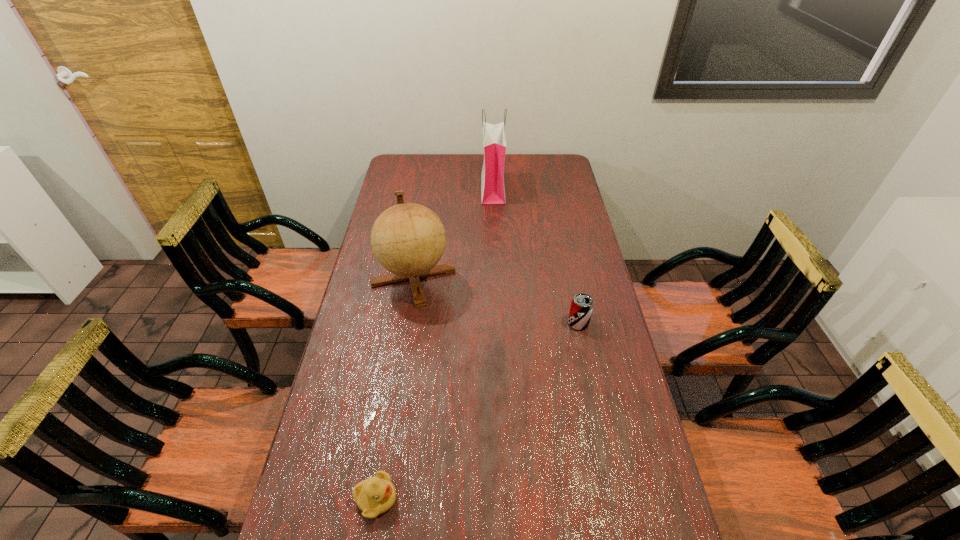
Image resolution: width=960 pixels, height=540 pixels. Find the location of `shopping bag`. shopping bag is located at coordinates (494, 138).

Find the location of a particular element. The height and width of the screenshot is (540, 960). the second object from right to left is located at coordinates (494, 138).

Where is `globe`? The height and width of the screenshot is (540, 960). globe is located at coordinates (408, 239).

This screenshot has width=960, height=540. Identify the location of soda can. (x=581, y=308).

Where is `the third farthest object`? Image resolution: width=960 pixels, height=540 pixels. the third farthest object is located at coordinates (581, 308).

Locate an element on the screen. duckling is located at coordinates (375, 495).

Locate an element on the screen. the shortest object is located at coordinates (375, 495).

This screenshot has width=960, height=540. Find the location of `vacant point located on the front-facing side of the farthest object`. vacant point located on the front-facing side of the farthest object is located at coordinates (421, 189).

Where is `free space located on the front-facing side of the farthest object`? The width and height of the screenshot is (960, 540). free space located on the front-facing side of the farthest object is located at coordinates (464, 189).

Locate an element on the screen. blank area located on the front-facing side of the farthest object is located at coordinates (455, 189).